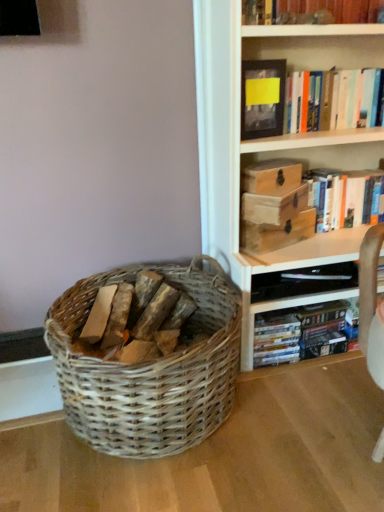
Identify the location of free space between matte black shelf at lower right and woven wood basket at lower left. This screenshot has height=512, width=384. (303, 388).